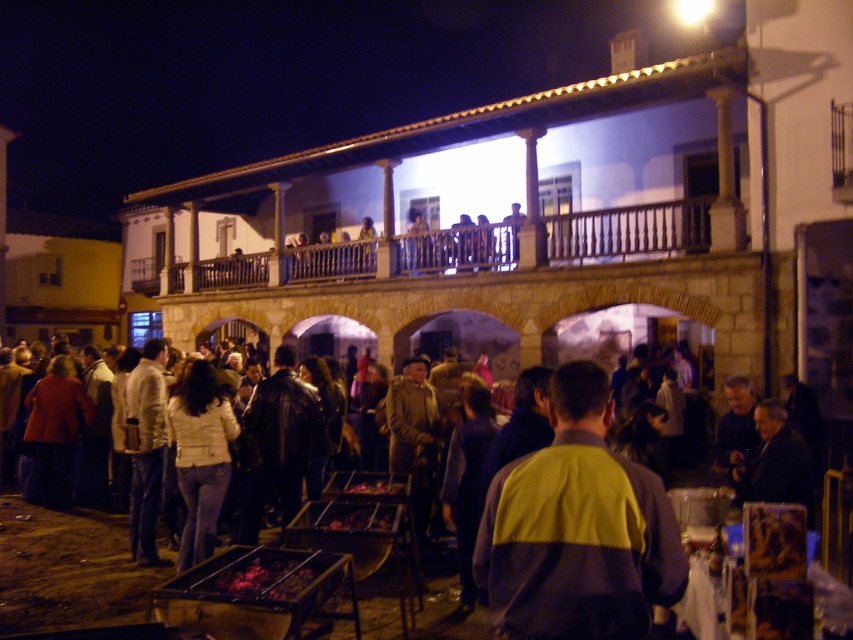
Which of these two, dark brown leather jacket at center or brown wooden railing at upper center, stands shorter?

dark brown leather jacket at center

Is dark brown leather jacket at center behind brown wooden railing at upper center?

No, dark brown leather jacket at center is in front of brown wooden railing at upper center.

Does point (109, 534) lie in front of point (300, 278)?

Yes, point (109, 534) is closer to viewer.

The image size is (853, 640). In order to click on dark brown leather jacket at center in this screenshot , I will do `click(70, 573)`.

Is yellow-gray jacket at center above brown wooden railing at upper center?

No.

Does yellow-gray jacket at center lie behind brown wooden railing at upper center?

No, it is not.

In order to click on yellow-gray jacket at center in this screenshot , I will do `click(576, 529)`.

Image resolution: width=853 pixels, height=640 pixels. What do you see at coordinates (576, 529) in the screenshot?
I see `yellow-gray jacket at center` at bounding box center [576, 529].

Can you confirm if yellow-gray jacket at center is positioned to the left of dark brown leather jacket at center?

Incorrect, yellow-gray jacket at center is not on the left side of dark brown leather jacket at center.

The height and width of the screenshot is (640, 853). What do you see at coordinates (576, 529) in the screenshot? I see `yellow-gray jacket at center` at bounding box center [576, 529].

You are a GUI agent. You are given a task and a screenshot of the screen. Output one action in this format:
    pyautogui.click(x=<x>, y=<y>)
    Task: Click on the yellow-gray jacket at center
    
    Given the screenshot: What is the action you would take?
    pyautogui.click(x=576, y=529)